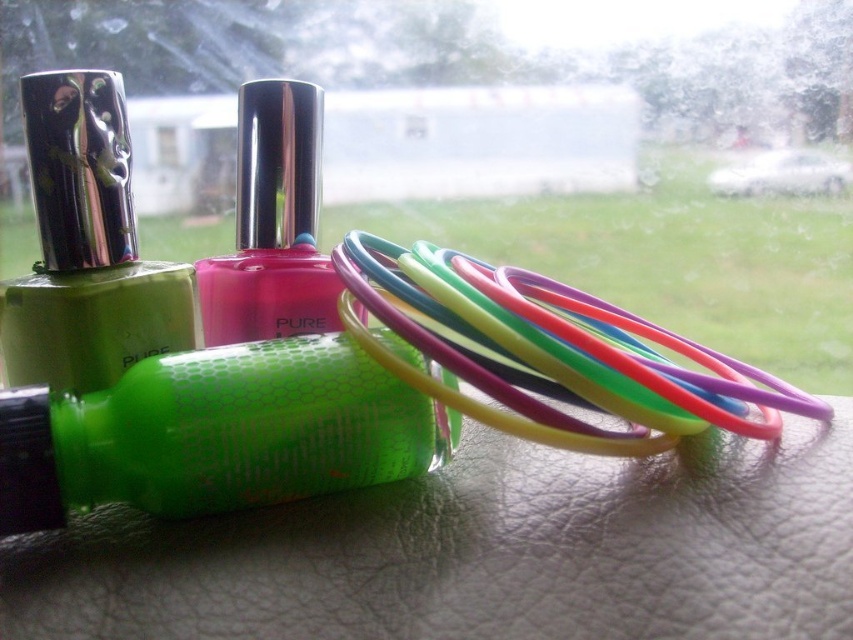
Who is shorter, neon green glossy nail polish at center or rubber bands at center?

neon green glossy nail polish at center is shorter.

The width and height of the screenshot is (853, 640). What do you see at coordinates (215, 433) in the screenshot?
I see `neon green glossy nail polish at center` at bounding box center [215, 433].

This screenshot has width=853, height=640. Identify the location of neon green glossy nail polish at center. (215, 433).

Identify the location of neon green glossy nail polish at center. Image resolution: width=853 pixels, height=640 pixels. (215, 433).

Who is positioned more to the right, neon green glossy nail polish at center or pink glossy nail polish at center?

neon green glossy nail polish at center

Is point (345, 433) in front of point (300, 150)?

Yes.

Image resolution: width=853 pixels, height=640 pixels. Find the location of `neon green glossy nail polish at center`. neon green glossy nail polish at center is located at coordinates (215, 433).

Does matte green nail polish at left appear on the left side of metallic silver lipstick at center?

Incorrect, matte green nail polish at left is not on the left side of metallic silver lipstick at center.

Is point (38, 272) less distant than point (102, 257)?

No, it is behind (102, 257).

Is point (68, 113) more distant than point (103, 128)?

No.

This screenshot has height=640, width=853. I want to click on matte green nail polish at left, so [86, 248].